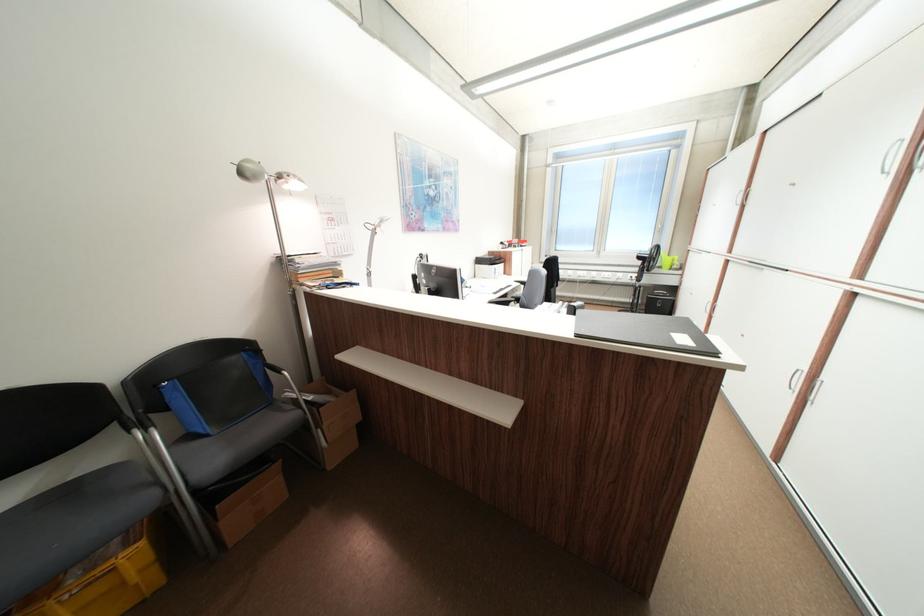
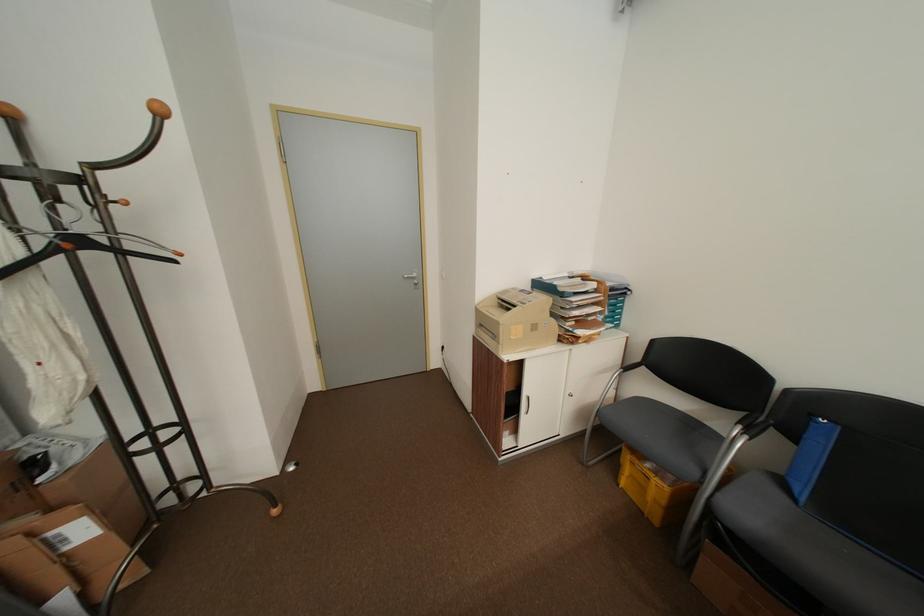
The point at (151, 544) is marked in the first image. Where is the corresponding point in the second image?

(676, 488)